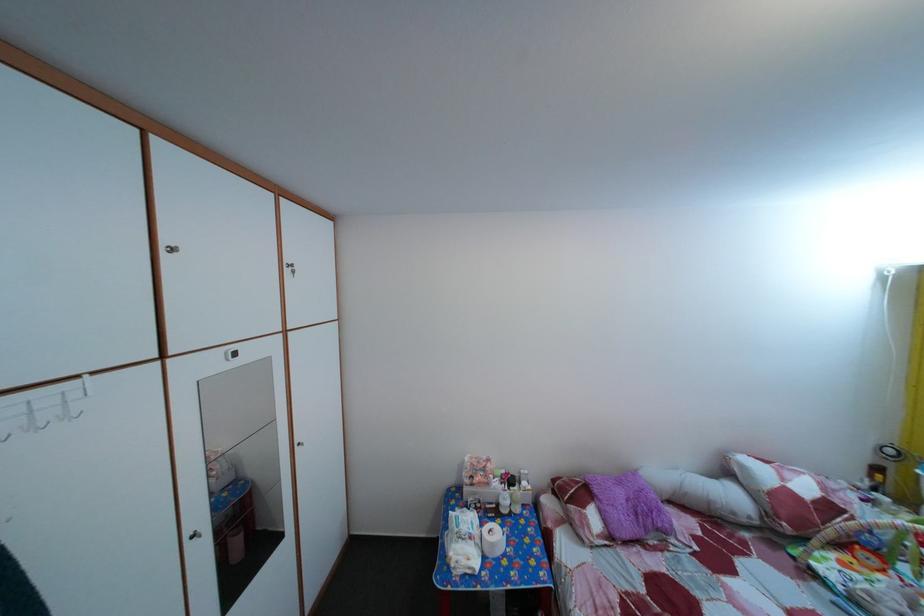
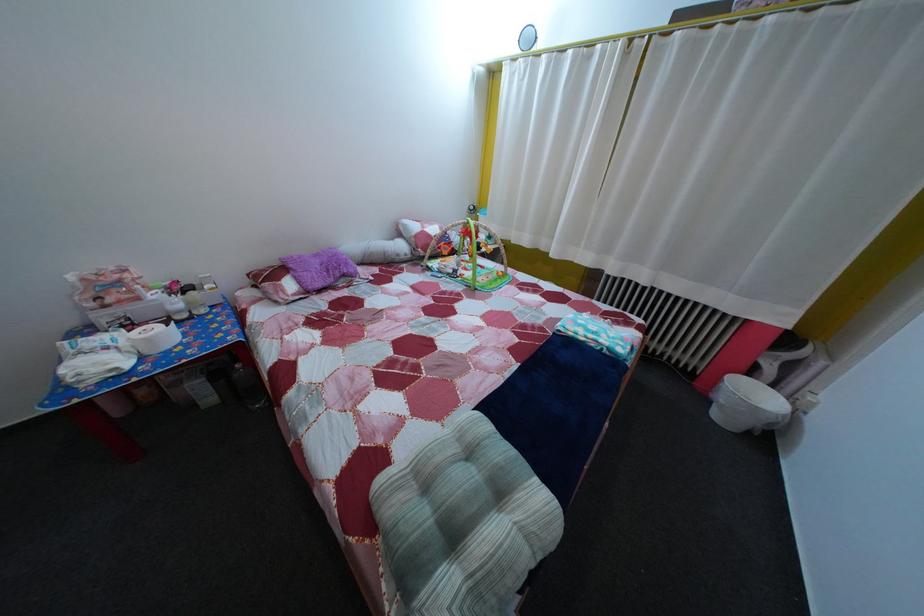
Where in the second image is the point corresponding to point (533, 492) from the first image?

(216, 294)